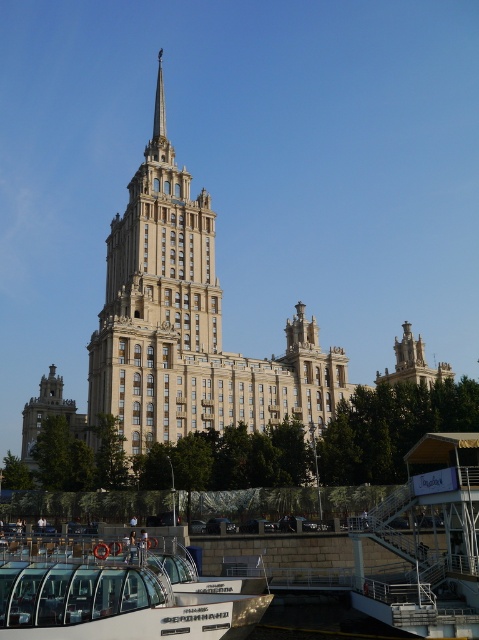
Between point (345, 369) and point (9, 561), which one is positioned in front?

Point (9, 561)

Which is behind, point (146, 426) or point (93, 561)?

Point (146, 426)

Image resolution: width=479 pixels, height=640 pixels. In order to click on beige stone building at center in this screenshot , I will do `click(189, 324)`.

Find the location of a particular element. This screenshot has height=640, width=479. beige stone building at center is located at coordinates (189, 324).

Is beige stone building at center below matte gold tower at lower left?

Actually, beige stone building at center is above matte gold tower at lower left.

Which is in front, point (317, 336) or point (35, 413)?

Point (317, 336) is more forward.

Measure the distance between beige stone building at center and camera.

beige stone building at center is 66.63 meters from camera.

In order to click on beige stone building at center in this screenshot , I will do `click(189, 324)`.

Which is in front, point (205, 621) or point (75, 436)?

Positioned in front is point (205, 621).

Does white glass boat at lower left appear under matte gold tower at lower left?

Correct, white glass boat at lower left is located below matte gold tower at lower left.

In order to click on white glass boat at lower left in this screenshot , I will do `click(118, 592)`.

I want to click on white glass boat at lower left, so click(118, 592).